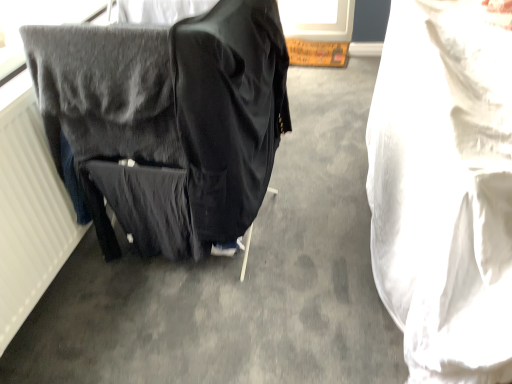
The width and height of the screenshot is (512, 384). I want to click on white fabric at right, so click(x=444, y=188).

The width and height of the screenshot is (512, 384). What do you see at coordinates (444, 188) in the screenshot? I see `white fabric at right` at bounding box center [444, 188].

The height and width of the screenshot is (384, 512). Identify the location of black fabric bag at left. (168, 122).

What is the approximate width of black fabric bag at left?

black fabric bag at left is 22.88 inches in width.

Image resolution: width=512 pixels, height=384 pixels. What do you see at coordinates (168, 122) in the screenshot?
I see `black fabric bag at left` at bounding box center [168, 122].

This screenshot has width=512, height=384. What are the coordinates of `white fabric at right` in the screenshot? It's located at pos(444,188).

Is black fabric bag at left to the left or to the right of white fabric at right in the image?

In the image, black fabric bag at left appears on the left side of white fabric at right.

Which is in front, black fabric bag at left or white fabric at right?

white fabric at right is in front.

Is point (121, 85) closer to viewer compared to point (509, 225)?

No, (121, 85) is behind (509, 225).

From the image's perspective, is black fabric bag at left above or below white fabric at right?

Clearly, from the image's perspective, black fabric bag at left is above white fabric at right.

Consider the image. From a real-world perspective, who is located lower, black fabric bag at left or white fabric at right?

white fabric at right.

Between black fabric bag at left and white fabric at right, which one has smaller width?

black fabric bag at left.

In the scene shown: From their relative heights in the image, would you say black fabric bag at left is taller or shorter than white fabric at right?

black fabric bag at left is taller than white fabric at right.

Does black fabric bag at left have a larger size compared to white fabric at right?

Incorrect, black fabric bag at left is not larger than white fabric at right.

Would you say black fabric bag at left contains white fabric at right?

Actually, white fabric at right is outside black fabric bag at left.

Are black fabric bag at left and white fabric at right located far from each other?

black fabric bag at left is actually quite close to white fabric at right.

Is black fabric bag at left oriented towards white fabric at right?

Yes, black fabric bag at left is aimed at white fabric at right.

What are the coordinates of `furniture behind the white fabric at right` in the screenshot? It's located at (168, 122).

Considering the positions of objects white fabric at right and black fabric bag at left in the image provided, who is more to the right, white fabric at right or black fabric bag at left?

From the viewer's perspective, white fabric at right appears more on the right side.

Does white fabric at right lie in front of black fabric bag at left?

Yes, it is.

Does point (380, 216) come in front of point (216, 178)?

No, (380, 216) is behind (216, 178).

From the image's perspective, relative to black fabric bag at left, is white fabric at right above or below?

Based on their image positions, white fabric at right is located beneath black fabric bag at left.

From a real-world perspective, is white fabric at right positioned under black fabric bag at left based on gravity?

Yes, from a real-world perspective, white fabric at right is beneath black fabric bag at left.

In the scene shown: Which of these two, white fabric at right or black fabric bag at left, is thinner?

Thinner between the two is black fabric bag at left.

Considering the sizes of objects white fabric at right and black fabric bag at left in the image provided, who is shorter, white fabric at right or black fabric bag at left?

white fabric at right is shorter.

Considering the sizes of objects white fabric at right and black fabric bag at left in the image provided, who is smaller, white fabric at right or black fabric bag at left?

black fabric bag at left.

Would you say white fabric at right is outside black fabric bag at left?

Yes.

Are white fabric at right and black fabric bag at left far apart?

No, white fabric at right is not far away from black fabric bag at left.

Is white fabric at right oriented towards black fabric bag at left?

No.

Find the location of `sheet beneath the black fabric bag at left (from a real-world perspective)`. sheet beneath the black fabric bag at left (from a real-world perspective) is located at coordinates (x=444, y=188).

Find the location of `sheet lying in front of the black fabric bag at left`. sheet lying in front of the black fabric bag at left is located at coordinates (444, 188).

The height and width of the screenshot is (384, 512). Identify the location of sheet that is below the black fabric bag at left (from the image's perspective). (444, 188).